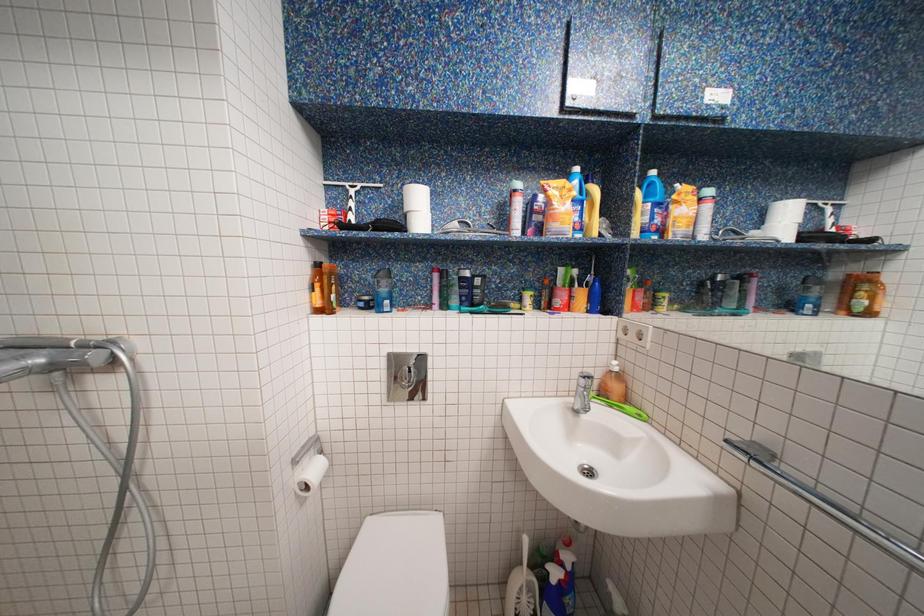
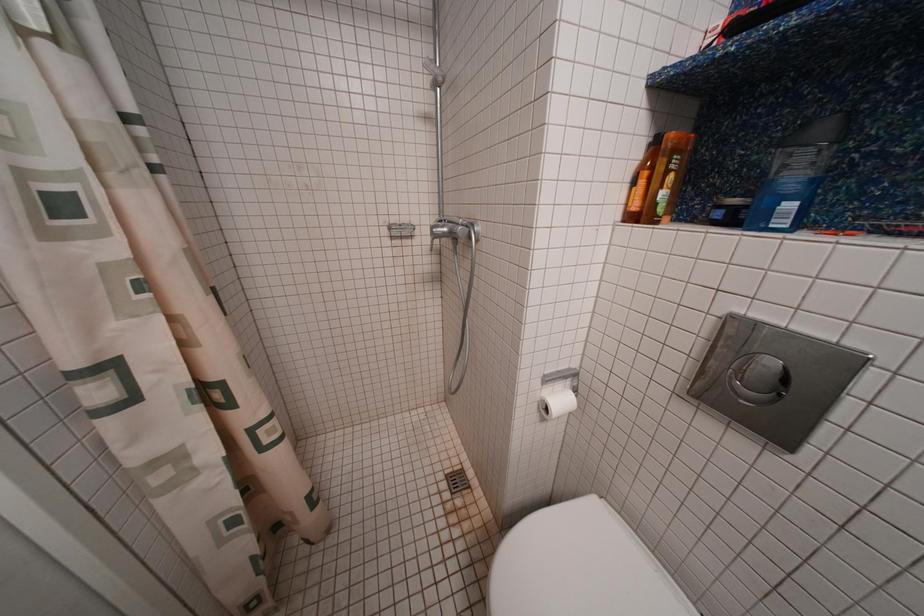
In the scene shown: How did the camera likely rotate?

The camera rotated toward left-down.